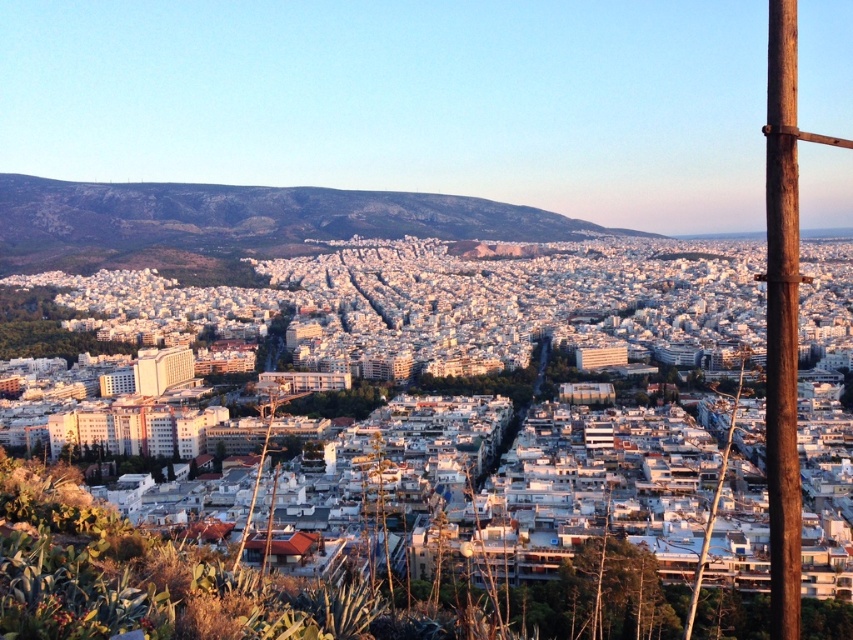
Between brown wooden pole at right and brown wooden telegraph pole at right, which one is positioned lower?

brown wooden telegraph pole at right

Which is in front, point (790, 376) or point (709, 518)?

Positioned in front is point (790, 376).

Measure the distance between point (780, 618) and camera.

Point (780, 618) and camera are 244.92 feet apart from each other.

The image size is (853, 640). I want to click on brown wooden pole at right, so click(x=782, y=321).